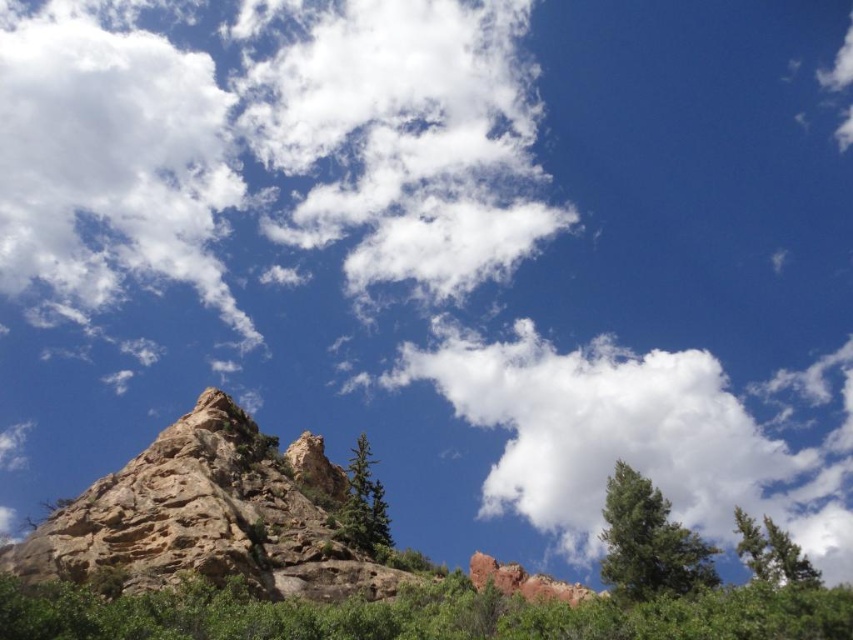
Question: Which object appears closest to the camera in this image?

Choices:
 (A) green textured tree at lower right
 (B) green matte tree at center
 (C) green matte tree at lower right
 (D) rugged stone mountain at center

Answer: (D)

Question: Can you confirm if green textured tree at lower right is positioned above green matte tree at center?

Choices:
 (A) no
 (B) yes

Answer: (A)

Question: Which object is positioned closest to the green textured tree at lower right?

Choices:
 (A) rugged stone mountain at center
 (B) white fluffy cloud at upper center
 (C) green matte tree at lower right
 (D) green matte tree at center

Answer: (C)

Question: Can you confirm if white fluffy cloud at upper center is bigger than green matte tree at lower right?

Choices:
 (A) yes
 (B) no

Answer: (A)

Question: Is the position of white fluffy cloud at upper center less distant than that of green textured tree at lower right?

Choices:
 (A) no
 (B) yes

Answer: (A)

Question: Which object appears closest to the camera in this image?

Choices:
 (A) green textured tree at lower right
 (B) white fluffy cloud at upper center
 (C) green matte tree at center
 (D) rugged stone mountain at center

Answer: (D)